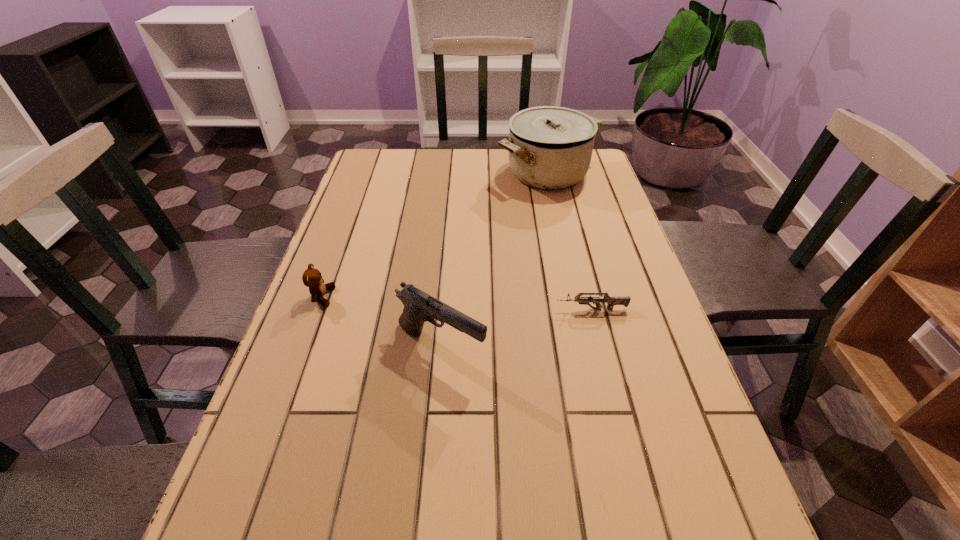
Locate an element on the screen. The height and width of the screenshot is (540, 960). saucepan is located at coordinates (550, 147).

What are the coordinates of `the tallest object` in the screenshot? It's located at (550, 147).

Identify the location of the third object from right to left. (419, 307).

The height and width of the screenshot is (540, 960). In order to click on the left gun in this screenshot , I will do `click(419, 307)`.

Identify the location of the second shortest object. This screenshot has width=960, height=540. (312, 278).

Locate an element on the screen. This screenshot has width=960, height=540. teddy bear is located at coordinates (312, 278).

Identify the location of the right gun. The image size is (960, 540). (611, 301).

At what (x,y) coordinates should I click in order to perform the action: click on the farther gun. Please return your answer as a coordinate pair (x, y). Image resolution: width=960 pixels, height=540 pixels. Looking at the image, I should click on (611, 301).

At what (x,y) coordinates should I click in order to perform the action: click on free region located 0.270m on the left of the tallest object. Please return your answer as a coordinate pair (x, y). This screenshot has width=960, height=540. Looking at the image, I should click on (414, 173).

Identify the location of vacant area located at the muzzle of the nearer gun. This screenshot has height=540, width=960. coord(616,348).